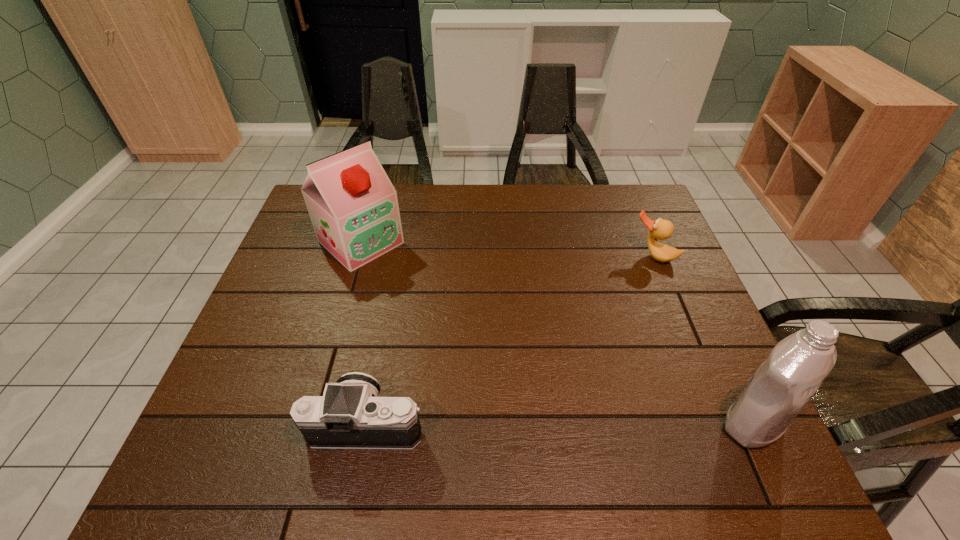
Where is `free space between the camera and the detergent`? free space between the camera and the detergent is located at coordinates (560, 423).

The height and width of the screenshot is (540, 960). What are the coordinates of `vacant region between the camera and the soya milk` in the screenshot? It's located at (365, 333).

Where is `vacant space that is in between the detergent and the soya milk`? This screenshot has height=540, width=960. vacant space that is in between the detergent and the soya milk is located at coordinates (557, 333).

I want to click on free area in between the camera and the shortest object, so click(511, 340).

Identify the location of vacant area between the soya milk and the shortest object. (507, 249).

Image resolution: width=960 pixels, height=540 pixels. Find the location of `object that is the second closest to the camera`. object that is the second closest to the camera is located at coordinates point(783,384).

This screenshot has height=540, width=960. Find the location of `object that can be found as the second closest to the soya milk`. object that can be found as the second closest to the soya milk is located at coordinates (660, 229).

Find the location of a particular element. free spot that satisfies the following two spatial constraints: 1. on the back side of the camera; 2. on the left side of the shortest object is located at coordinates click(x=400, y=255).

In order to click on free point that satisfies the following two spatial constraints: 1. on the front side of the soya milk; 2. on the left side of the camera in this screenshot , I will do `click(308, 424)`.